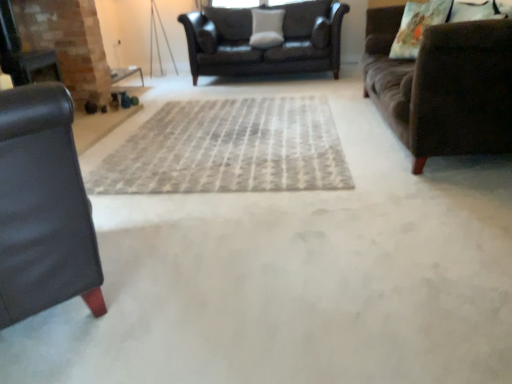
Question: Is black leather couch at left, the 3th studio couch when ordered from back to front, taller or shorter than black leather fireplace at left?

Choices:
 (A) short
 (B) tall

Answer: (A)

Question: From a real-world perspective, is black leather couch at left, which ranks as the first studio couch in front-to-back order, above or below black leather fireplace at left?

Choices:
 (A) above
 (B) below

Answer: (B)

Question: Which object is positioned farthest from the white fabric pillow at center, positioned as the second pillow in bottom-to-top order?

Choices:
 (A) dark brown leather couch at center, which is counted as the third studio couch, starting from the front
 (B) black leather fireplace at left
 (C) printed fabric pillow at upper right, the 1th pillow in the front-to-back sequence
 (D) brown fabric couch at right, the 2th studio couch in the back-to-front sequence
 (E) black leather couch at left, the 3th studio couch when ordered from back to front

Answer: (E)

Question: Which object is positioned closest to the gray woven rug at center?

Choices:
 (A) brown fabric couch at right, which is the 2th studio couch in front-to-back order
 (B) white fabric pillow at center, the 2th pillow viewed from the front
 (C) printed fabric pillow at upper right, the 1th pillow viewed from the right
 (D) black leather couch at left, the 3th studio couch when ordered from back to front
 (E) dark brown leather couch at center, the 1th studio couch from the back

Answer: (A)